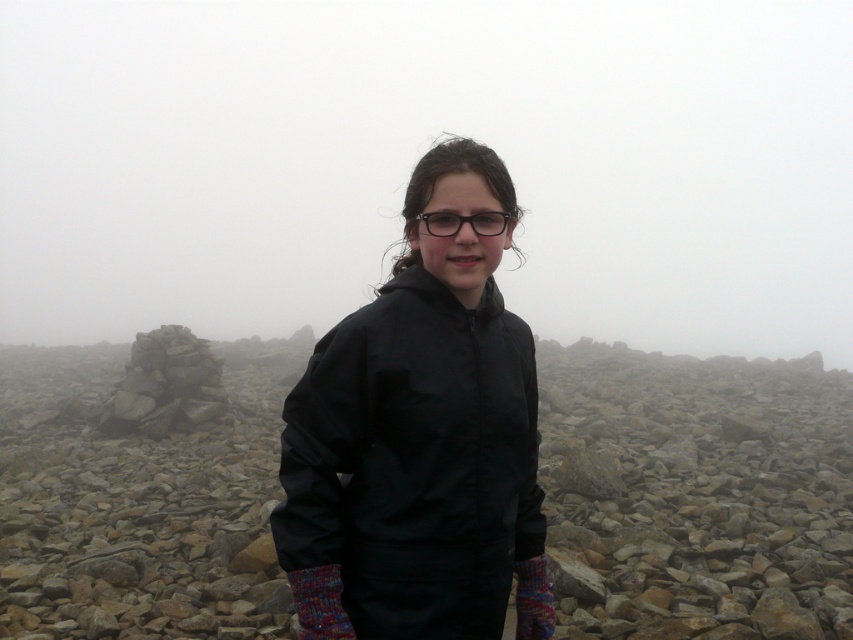
Does black/waterproof jacket at center have a greater width compared to transparent plastic glasses at center?

Yes.

Which is in front, point (485, 352) or point (456, 225)?

Positioned in front is point (456, 225).

The height and width of the screenshot is (640, 853). I want to click on black/waterproof jacket at center, so click(415, 461).

This screenshot has height=640, width=853. What are the coordinates of `black fabric jacket at center` in the screenshot? It's located at (695, 493).

Does black fabric jacket at center have a greater height compared to black/waterproof jacket at center?

Correct, black fabric jacket at center is much taller as black/waterproof jacket at center.

Which is behind, point (608, 442) or point (438, 572)?

The point (608, 442) is more distant.

Locate an element on the screen. Image resolution: width=853 pixels, height=640 pixels. black fabric jacket at center is located at coordinates (695, 493).

Between point (93, 525) and point (448, 218), which one is positioned behind?

The point (93, 525) is more distant.

Is black fabric jacket at center taller than transparent plastic glasses at center?

Yes.

Does point (73, 387) come behind point (491, 221)?

That is True.

Locate an element on the screen. Image resolution: width=853 pixels, height=640 pixels. black fabric jacket at center is located at coordinates tap(695, 493).